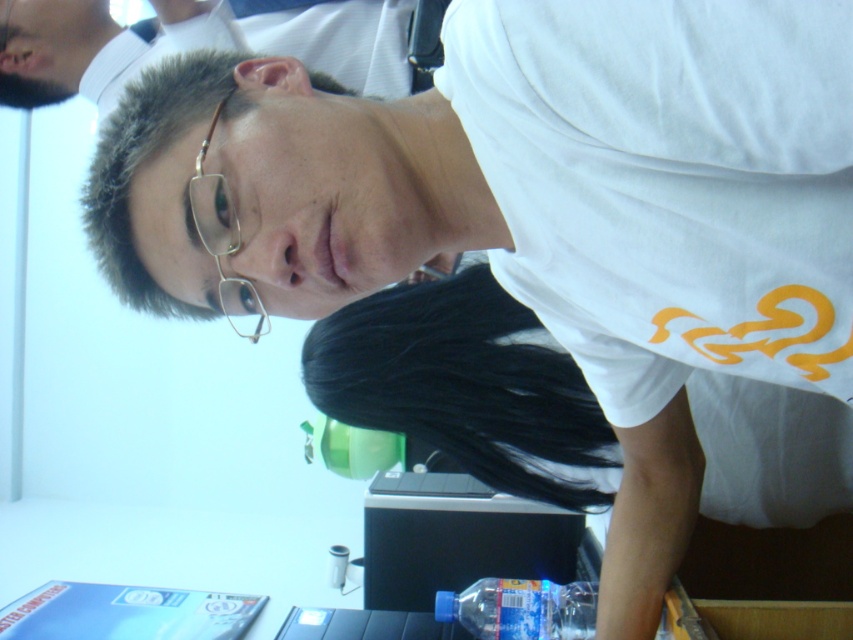
From the picture: Which is below, matte white shirt at upper center or black plastic table at lower center?

black plastic table at lower center

Is point (111, 51) closer to viewer compared to point (219, 538)?

Yes, point (111, 51) is in front of point (219, 538).

You are a GUI agent. You are given a task and a screenshot of the screen. Output one action in this format:
    pyautogui.click(x=<x>, y=<y>)
    Task: Click on the matte white shirt at upper center
    The image size is (853, 640).
    Given the screenshot: What is the action you would take?
    pyautogui.click(x=212, y=42)

You are a GUI agent. You are given a task and a screenshot of the screen. Output one action in this format:
    pyautogui.click(x=<x>, y=<y>)
    Task: Click on the matte white shirt at upper center
    The image size is (853, 640).
    Given the screenshot: What is the action you would take?
    pyautogui.click(x=212, y=42)

Describe the element at coordinates (212, 42) in the screenshot. I see `matte white shirt at upper center` at that location.

Does point (25, 54) come in front of point (492, 604)?

No, (25, 54) is behind (492, 604).

Does point (154, 20) lie behind point (553, 595)?

That is True.

Identify the location of matte white shirt at upper center. The image size is (853, 640). (212, 42).

Does matte white shirt at upper center appear on the left side of gold metallic glasses at upper center?

Yes, matte white shirt at upper center is to the left of gold metallic glasses at upper center.

Is point (323, 56) less distant than point (204, 195)?

No, it is not.

Is point (345, 49) farther from viewer compared to point (202, 198)?

Yes, it is behind point (202, 198).

Find the location of a particular element. matte white shirt at upper center is located at coordinates (212, 42).